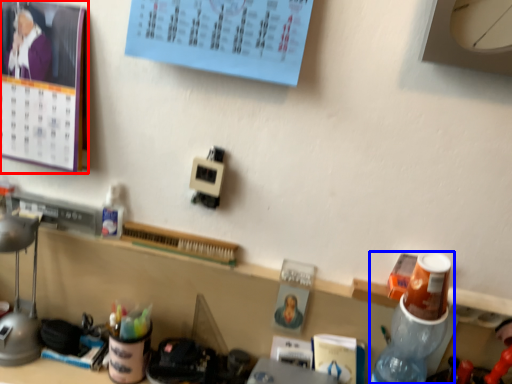
Question: Which point is further to the camera, bulletin board (highlighted by a red box) or bottle (highlighted by a blue box)?

Choices:
 (A) bulletin board
 (B) bottle

Answer: (A)